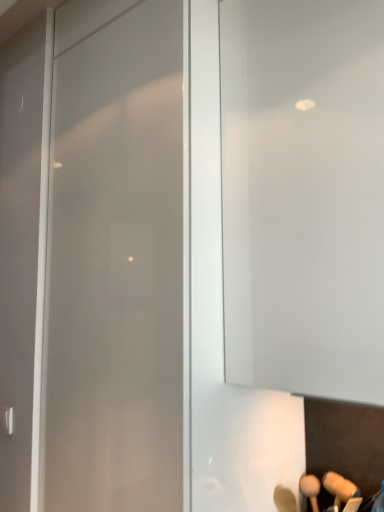
Question: Can you confirm if satin silver handle at lower left is positioned to the right of transparent glass door at center?

Choices:
 (A) yes
 (B) no

Answer: (B)

Question: Is satin silver handle at lower left further to the viewer compared to transparent glass door at center?

Choices:
 (A) yes
 (B) no

Answer: (A)

Question: From a real-world perspective, is satin silver handle at lower left located beneath transparent glass door at center?

Choices:
 (A) no
 (B) yes

Answer: (B)

Question: Could you tell me if satin silver handle at lower left is turned towards transparent glass door at center?

Choices:
 (A) yes
 (B) no

Answer: (B)

Question: Is satin silver handle at lower left at the left side of transparent glass door at center?

Choices:
 (A) yes
 (B) no

Answer: (A)

Question: From the image's perspective, does satin silver handle at lower left appear higher than transparent glass door at center?

Choices:
 (A) yes
 (B) no

Answer: (B)

Question: From the image's perspective, is transparent glass door at center on top of satin silver handle at lower left?

Choices:
 (A) no
 (B) yes

Answer: (B)

Question: From the image's perspective, is transparent glass door at center located beneath satin silver handle at lower left?

Choices:
 (A) yes
 (B) no

Answer: (B)

Question: Does transparent glass door at center turn towards satin silver handle at lower left?

Choices:
 (A) yes
 (B) no

Answer: (B)

Question: Is transparent glass door at center shorter than satin silver handle at lower left?

Choices:
 (A) yes
 (B) no

Answer: (B)

Question: Is transparent glass door at center closer to camera compared to satin silver handle at lower left?

Choices:
 (A) yes
 (B) no

Answer: (A)

Question: Is transparent glass door at center wider than satin silver handle at lower left?

Choices:
 (A) yes
 (B) no

Answer: (A)

Question: From the image's perspective, is satin silver handle at lower left above or below transparent glass door at center?

Choices:
 (A) above
 (B) below

Answer: (B)